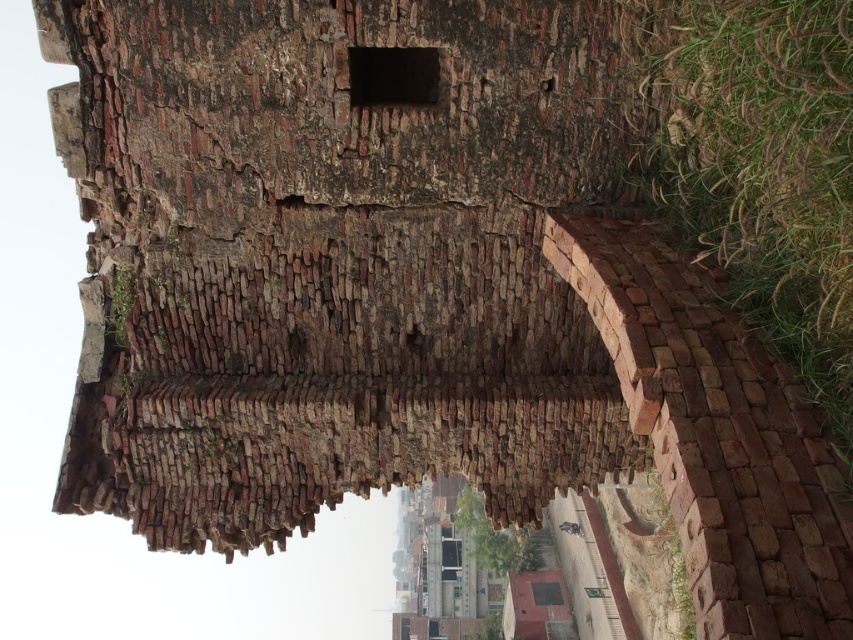
Does green rough grass at right have a lesser height compared to rustic brick hut at center?

Yes, green rough grass at right is shorter than rustic brick hut at center.

What do you see at coordinates (755, 164) in the screenshot?
I see `green rough grass at right` at bounding box center [755, 164].

Does point (672, 60) come in front of point (531, 604)?

That is True.

The image size is (853, 640). What are the coordinates of `green rough grass at right` in the screenshot? It's located at tap(755, 164).

Can you confirm if dark gray stone hole at center is positioned to the left of rustic brick hut at center?

Correct, you'll find dark gray stone hole at center to the left of rustic brick hut at center.

Does dark gray stone hole at center have a larger size compared to rustic brick hut at center?

Incorrect, dark gray stone hole at center is not larger than rustic brick hut at center.

What do you see at coordinates (393, 76) in the screenshot?
I see `dark gray stone hole at center` at bounding box center [393, 76].

Identify the location of dark gray stone hole at center. (393, 76).

Who is more forward, (798, 109) or (418, 56)?

Point (798, 109)

Is green rough grass at right bigger than dark gray stone hole at center?

Yes.

Between point (664, 172) and point (409, 65), which one is positioned in front?

Point (664, 172)

The width and height of the screenshot is (853, 640). Identify the location of green rough grass at right. (755, 164).